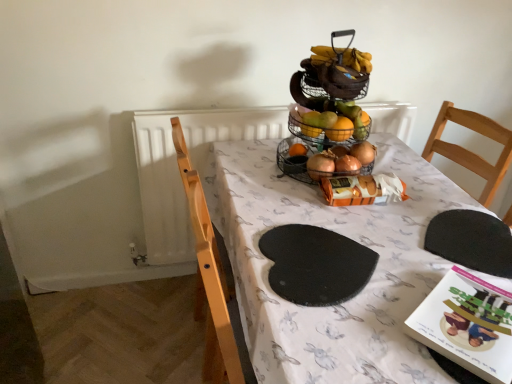
This screenshot has width=512, height=384. Find the location of `vacant area that lies between black rubber placemat at lower right, positioned as the 2th mat in left-to-right order, and black felt mat at center, which ranks as the first mat in left-to-right order`. vacant area that lies between black rubber placemat at lower right, positioned as the 2th mat in left-to-right order, and black felt mat at center, which ranks as the first mat in left-to-right order is located at coordinates point(396,243).